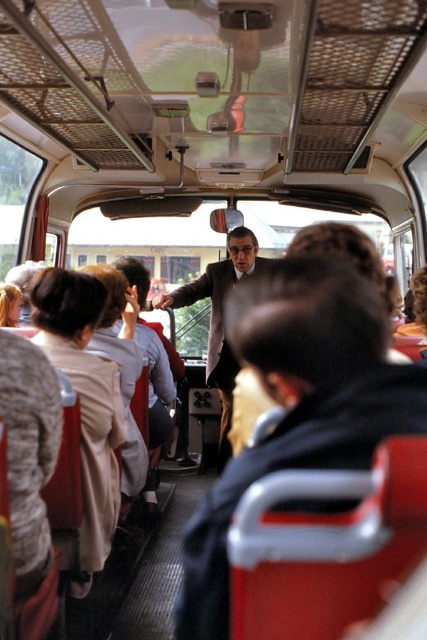
Question: Is matte black jacket at center further to camera compared to dark gray suit at center?

Choices:
 (A) yes
 (B) no

Answer: (B)

Question: Which point appears closest to the camera in this image?

Choices:
 (A) (362, 410)
 (B) (114, 429)
 (C) (210, 323)

Answer: (A)

Question: Is matte black jacket at center closer to camera compared to dark gray suit at center?

Choices:
 (A) no
 (B) yes

Answer: (B)

Question: Is beige fabric coat at left behind dark gray suit at center?

Choices:
 (A) yes
 (B) no

Answer: (B)

Question: Among these objects, which one is farthest from the camera?

Choices:
 (A) matte black jacket at center
 (B) beige fabric coat at left
 (C) dark gray suit at center

Answer: (C)

Question: Among these points, which one is farthest from the camera?

Choices:
 (A) (101, 522)
 (B) (301, 300)
 (C) (210, 278)

Answer: (C)